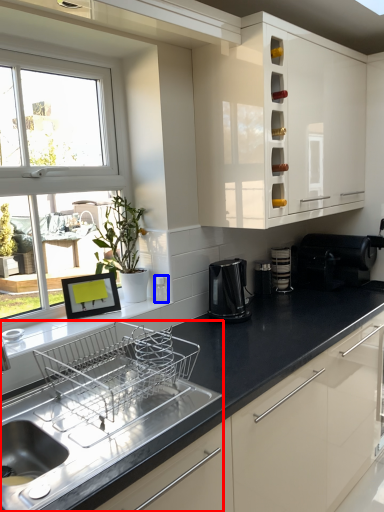
Question: Which point is further to the camera, sink (highlighted by a red box) or appliance (highlighted by a blue box)?

Choices:
 (A) sink
 (B) appliance

Answer: (B)